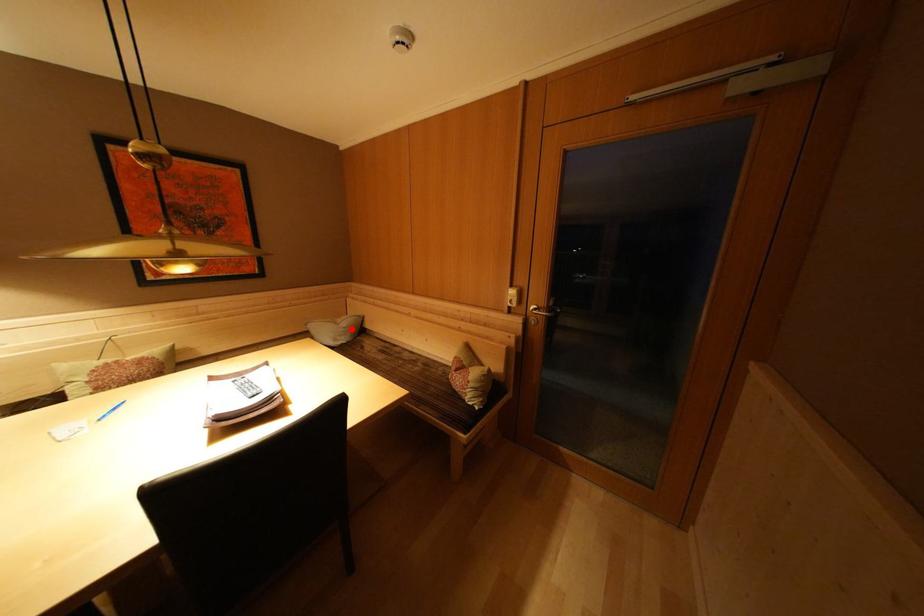
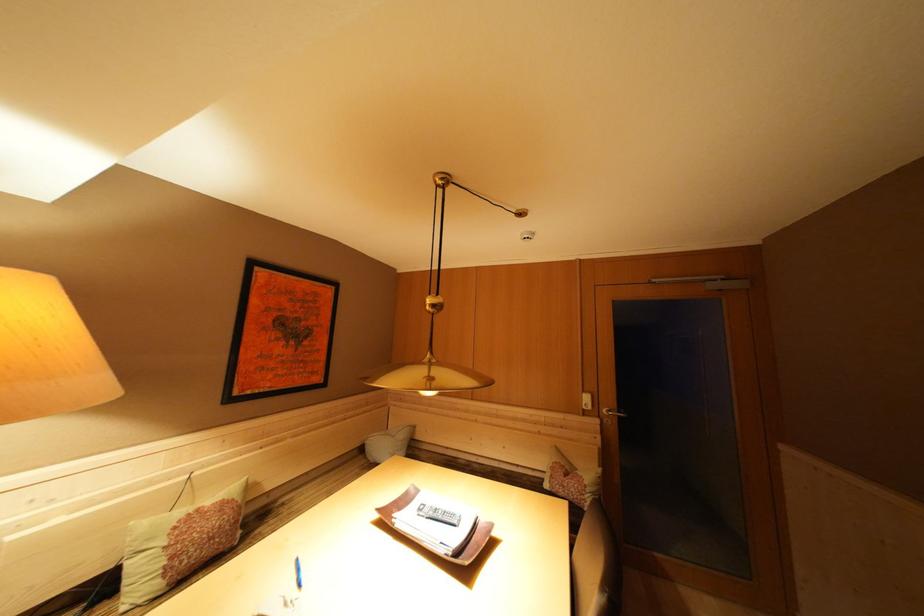
Question: I am providing you with two images of the same scene from different viewpoints. A red point is shown in image1. For the corresponding object point in image2, is it positioned nearer or farther from the camera?

Choices:
 (A) Nearer
 (B) Farther

Answer: (B)